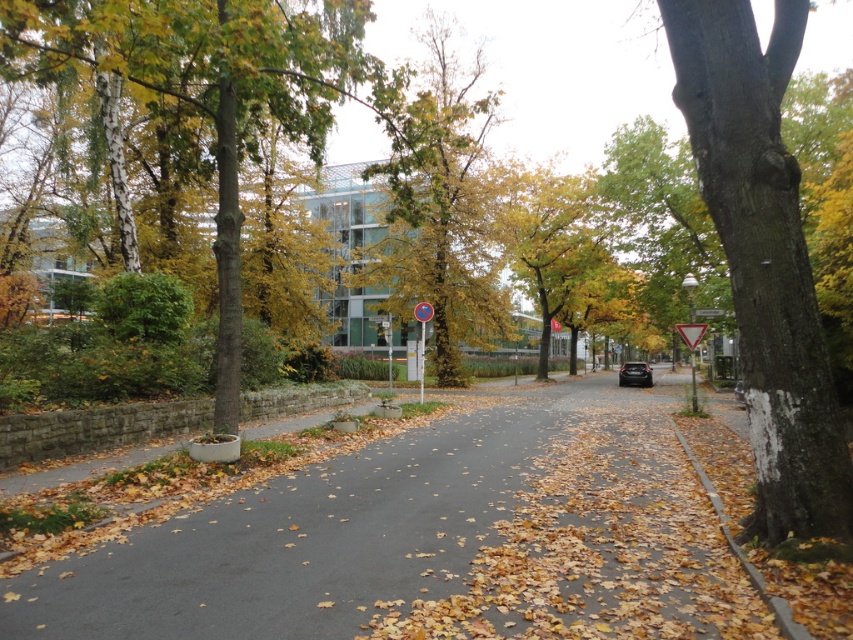
Question: Estimate the real-world distances between objects in this image. Which object is farther from the green smooth tree at left?

Choices:
 (A) yellow-green leaves at center
 (B) shiny black car at center
 (C) smooth asphalt road at center
 (D) metallic rectangular sign at center

Answer: (B)

Question: From the image, what is the correct spatial relationship of smooth bark tree at right in relation to metallic rectangular sign at center?

Choices:
 (A) left
 (B) right

Answer: (B)

Question: Is smooth asphalt road at center positioned at the back of smooth bark tree at right?

Choices:
 (A) yes
 (B) no

Answer: (B)

Question: Can you confirm if smooth asphalt road at center is positioned below green smooth tree at left?

Choices:
 (A) yes
 (B) no

Answer: (A)

Question: Estimate the real-world distances between objects in this image. Which object is farther from the smooth bark tree at right?

Choices:
 (A) smooth asphalt road at center
 (B) yellow-green leaves at center
 (C) metallic rectangular sign at center
 (D) green smooth tree at left

Answer: (B)

Question: Which object appears closest to the camera in this image?

Choices:
 (A) yellow-green leaves at center
 (B) smooth asphalt road at center
 (C) smooth bark tree at right
 (D) green smooth tree at left

Answer: (B)